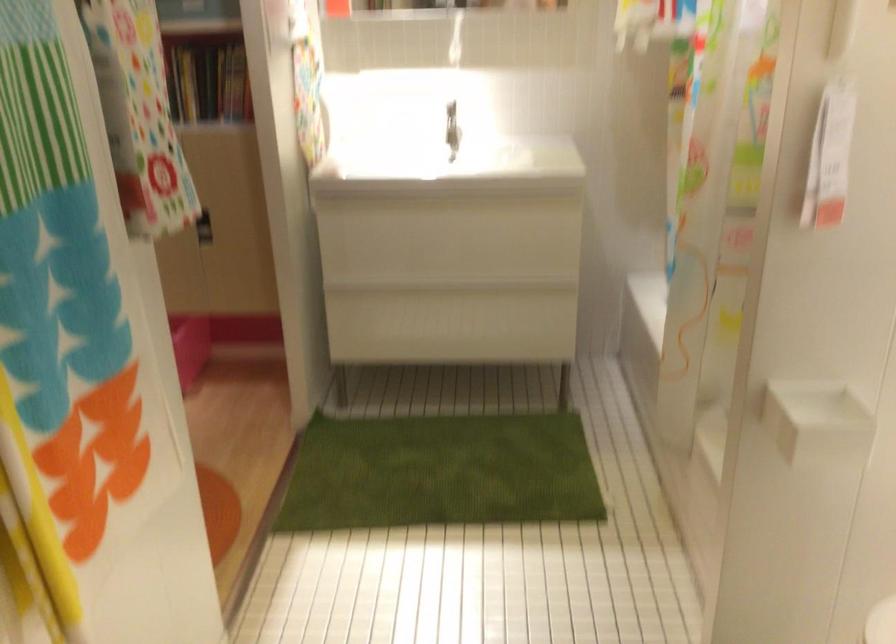
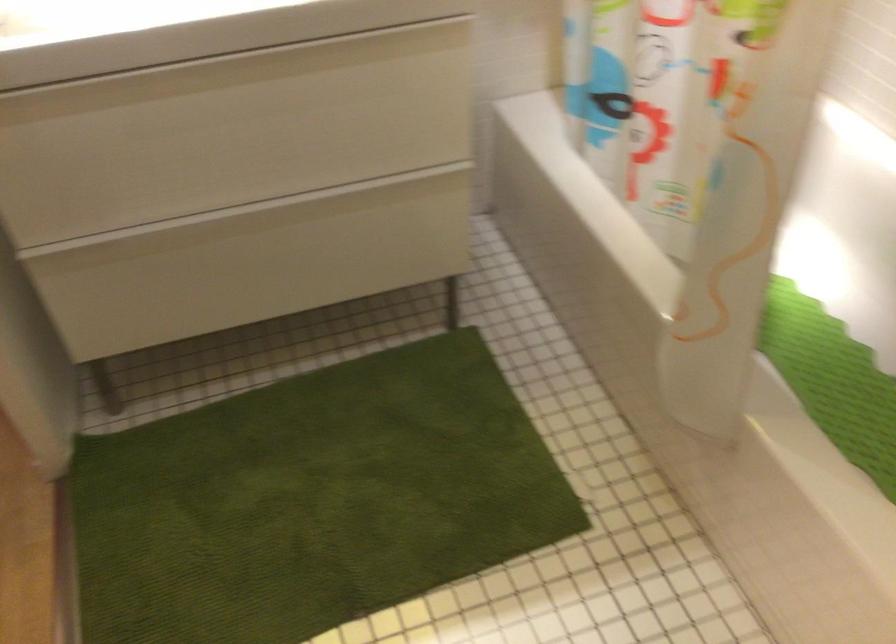
In the second image, find the point that corresponds to point 464,308 in the first image.

(289, 238)